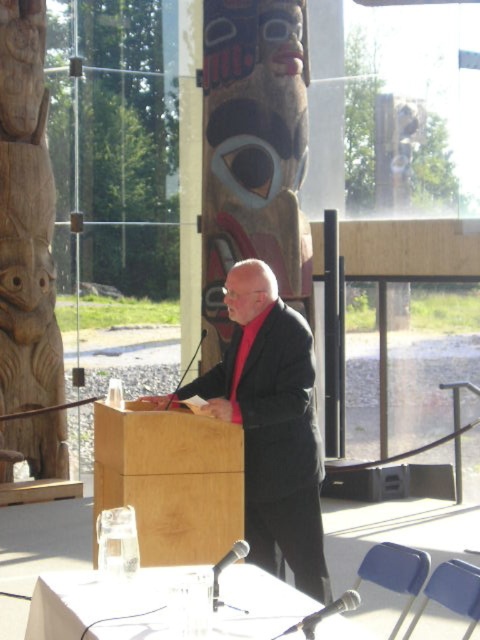
Question: Is wooden totem pole at left wider than light wood podium at center?

Choices:
 (A) yes
 (B) no

Answer: (B)

Question: Among these objects, which one is farthest from the camera?

Choices:
 (A) wooden totem pole at left
 (B) light wood podium at center

Answer: (A)

Question: Which object is farther from the camera taking this photo?

Choices:
 (A) wooden totem pole at left
 (B) light wood podium at center
 (C) dark gray suit at center

Answer: (A)

Question: Is dark gray suit at center positioned before wooden totem pole at left?

Choices:
 (A) no
 (B) yes

Answer: (B)

Question: Among these points, which one is nearest to the camera?

Choices:
 (A) (297, 563)
 (B) (208, 524)

Answer: (B)

Question: Is dark gray suit at center to the left of light wood podium at center from the viewer's perspective?

Choices:
 (A) no
 (B) yes

Answer: (A)